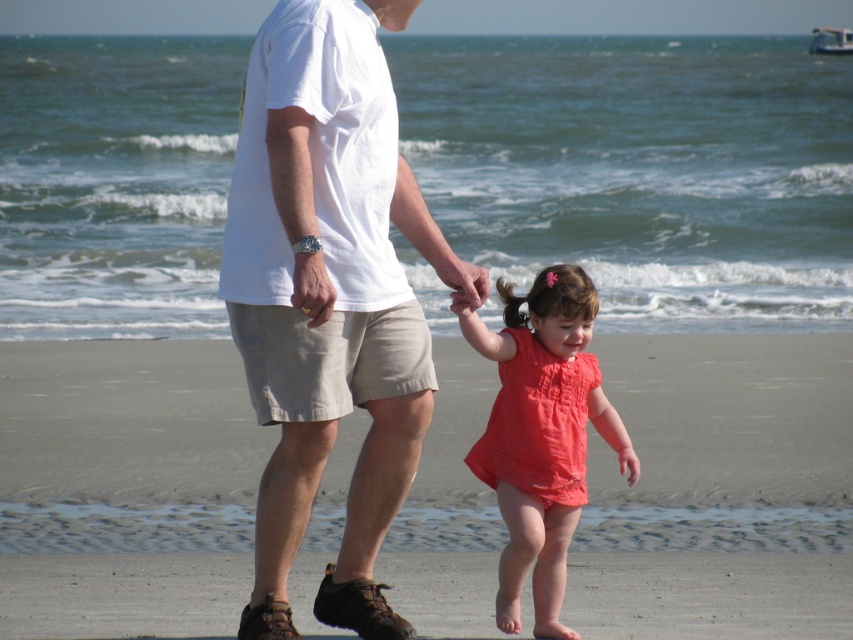
From the picture: You are designing a photo frame that needs to accommodate both the white cotton shirt at center and the matte coral dress at center in the image. Since the frame has a fixed width, which object should be placed first to ensure both fit side by side?

The white cotton shirt at center should be placed first because its width is larger than the matte coral dress at center, ensuring there is enough space for both when arranged side by side.

You are standing at the edge of the ocean and want to walk towards the smooth sand at lower center. According to the coordinates provided, in which direction should you move?

The smooth sand at lower center is located at coordinates point (718, 484), so you should move towards the lower center direction to reach it.